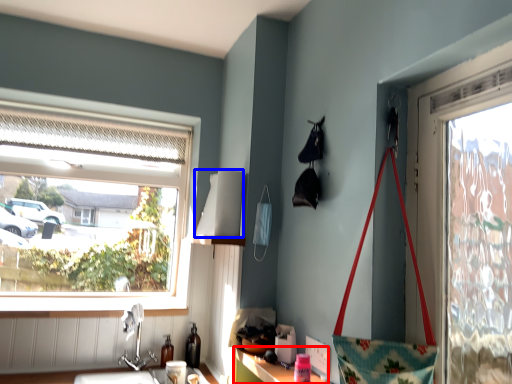
Question: Which point is further to the camera, cabinetry (highlighted by a red box) or lampshade (highlighted by a blue box)?

Choices:
 (A) cabinetry
 (B) lampshade

Answer: (B)